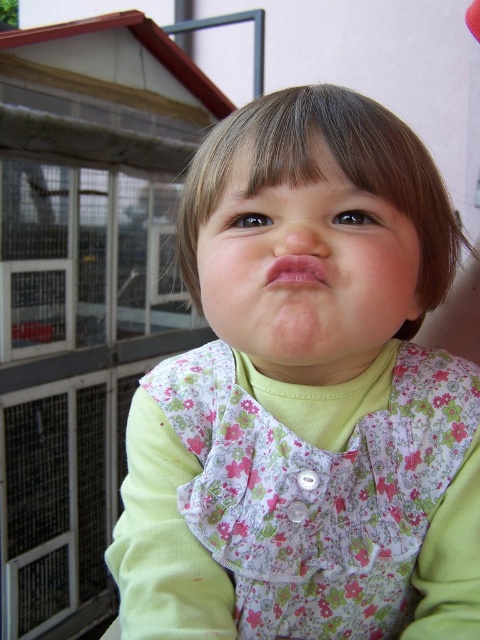
Can you confirm if smooth skin face at center is positioned above pink matte lips at center?

Actually, smooth skin face at center is below pink matte lips at center.

Consider the image. Which of these two, smooth skin face at center or pink matte lips at center, stands shorter?

Standing shorter between the two is pink matte lips at center.

Is point (291, 248) behind point (297, 269)?

No, it is in front of (297, 269).

Locate an element on the screen. This screenshot has width=480, height=640. smooth skin face at center is located at coordinates (310, 282).

Between floral fabric dress at center and smooth skin face at center, which one is positioned lower?

floral fabric dress at center

Which is in front, point (169, 497) or point (283, 328)?

Point (283, 328)

Between point (310, 630) and point (333, 324), which one is positioned in front?

Point (333, 324)

Identify the location of floral fabric dress at center. The image size is (480, 640). (307, 396).

Is floral fabric dress at center positioned behind pink matte lips at center?

No.

Does floral fabric dress at center have a greater width compared to pink matte lips at center?

Yes.

Between point (299, 435) and point (324, 273), which one is positioned behind?

Point (299, 435)

The height and width of the screenshot is (640, 480). Identify the location of floral fabric dress at center. (307, 396).